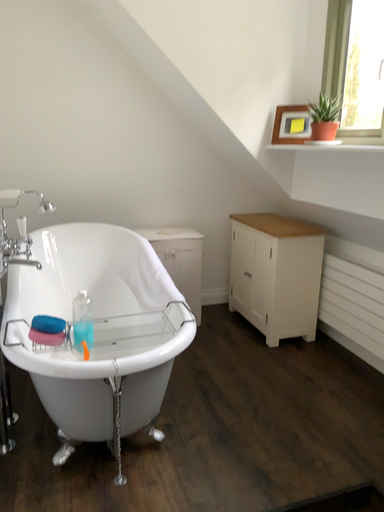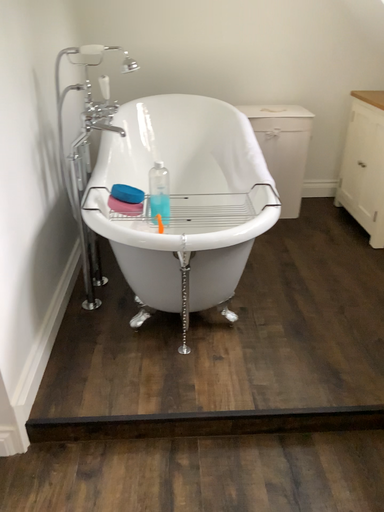
Question: Which way did the camera rotate in the video?

Choices:
 (A) rotated downward
 (B) rotated upward

Answer: (A)